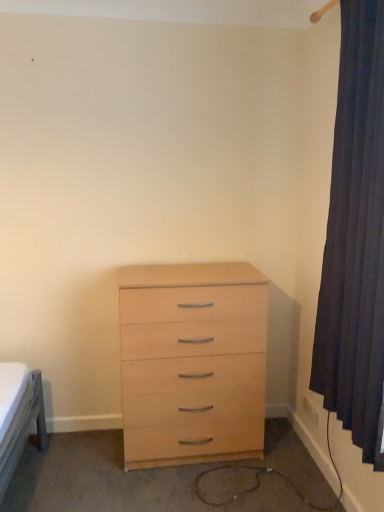
Locate an element on the screen. This screenshot has width=384, height=512. free space in front of light wood chest of drawers at center is located at coordinates (193, 488).